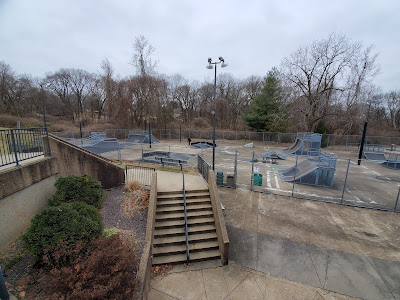
This screenshot has height=300, width=400. Find the location of `stairway hand rail`. stairway hand rail is located at coordinates (185, 227).